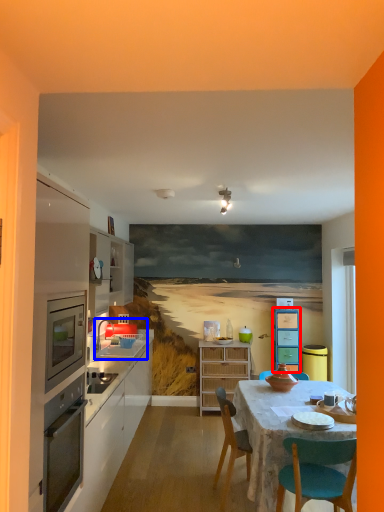
Question: Among these objects, which one is farthest to the camera, cabinetry (highlighted by a red box) or sink (highlighted by a blue box)?

Choices:
 (A) cabinetry
 (B) sink

Answer: (A)